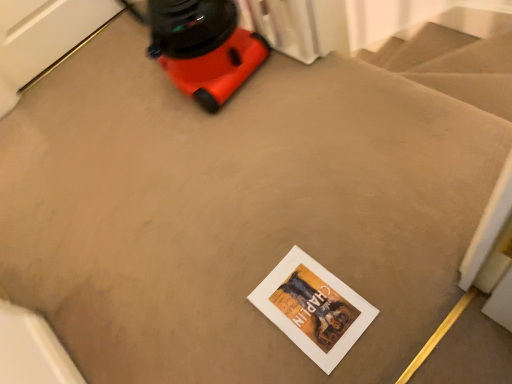
Where is `free space on the front side of orange plastic vacuum cleaner at upper left`? This screenshot has width=512, height=384. free space on the front side of orange plastic vacuum cleaner at upper left is located at coordinates (204, 141).